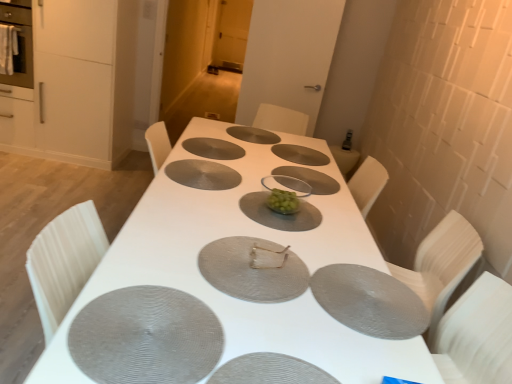
I want to click on vacant space in front of gray textured placemat at center, the 5th pizza pan in the front-to-back sequence, so click(201, 199).